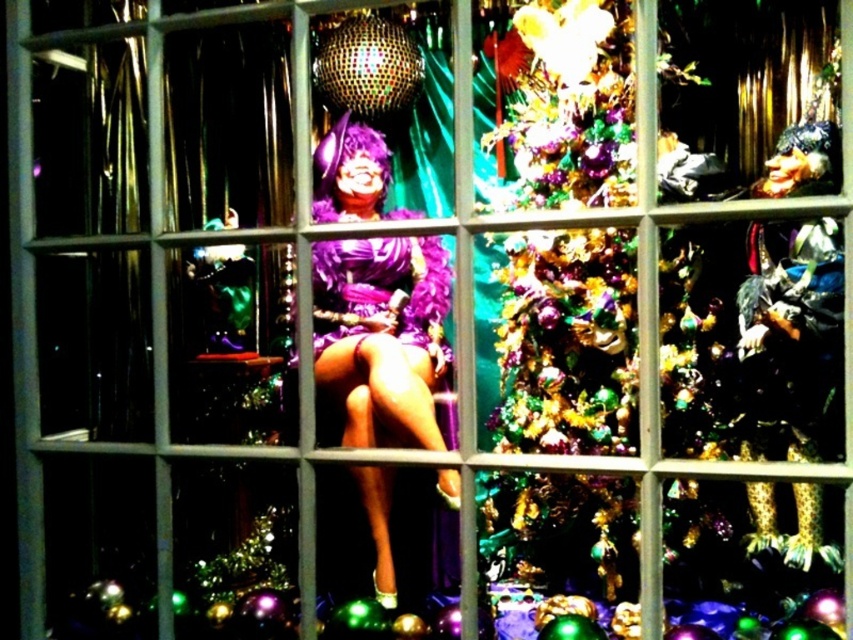
You are an interior designer observing the festive display through the window. You need to determine which dress is closer to the window. Based on the purple feathered dress at center and the purple satin dress at center, which one is positioned closer to the window?

The purple feathered dress at center is in front of the purple satin dress at center, so it is closer to the window.

You are an interior designer planning to place a 30 cm wide decorative item between the shiny gold tinsel at center and the purple feathered dress at center. Is there enough space?

The distance between the shiny gold tinsel at center and the purple feathered dress at center is 33.02 centimeters. Since the decorative item is 30 cm wide, there is enough space to place it between them.